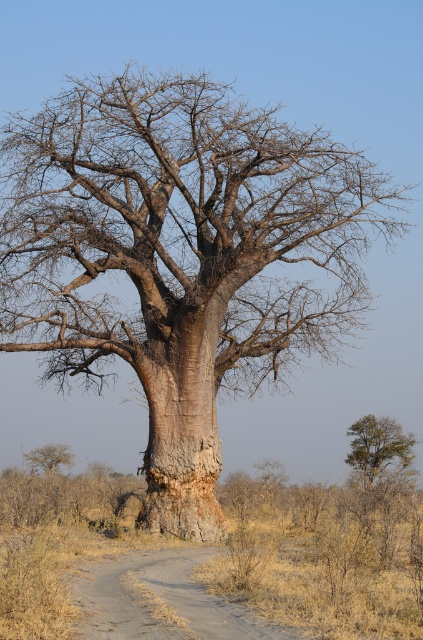
Question: Can you confirm if brown dirt track at lower center is wider than green leafy tree at upper right?

Choices:
 (A) yes
 (B) no

Answer: (B)

Question: Which object is positioned closest to the gray bark tree at lower left?

Choices:
 (A) green leafy tree at upper right
 (B) brown dirt track at lower center

Answer: (A)

Question: In this image, where is brown dirt track at lower center located relative to gray bark tree at lower left?

Choices:
 (A) below
 (B) above

Answer: (B)

Question: Is green leafy tree at upper right to the right of gray bark tree at lower left from the viewer's perspective?

Choices:
 (A) no
 (B) yes

Answer: (B)

Question: Which object is farther from the camera taking this photo?

Choices:
 (A) brown dirt track at lower center
 (B) green leafy tree at upper right

Answer: (B)

Question: Among these points, which one is nearest to the camera?

Choices:
 (A) (368, 445)
 (B) (54, 456)
 (C) (125, 637)

Answer: (C)